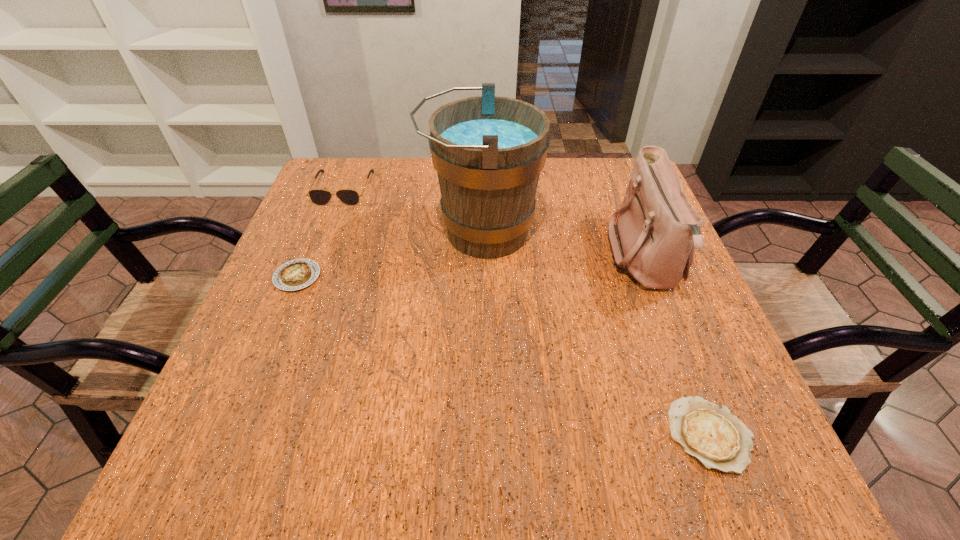
The height and width of the screenshot is (540, 960). I want to click on vacant area at the far right corner of the desktop, so click(x=627, y=171).

Find the location of a particular element. vacant area that lies between the sunglasses and the right quiche is located at coordinates coord(526,312).

You are a GUI agent. You are given a task and a screenshot of the screen. Output one action in this format:
    pyautogui.click(x=<x>, y=<y>)
    Task: Click on the free spot between the third tallest object and the left quiche
    
    Given the screenshot: What is the action you would take?
    pyautogui.click(x=321, y=232)

At what (x,y) coordinates should I click in order to perform the action: click on unoccupied position between the farther quiche and the sunglasses. Please return your answer as a coordinate pair (x, y). Image resolution: width=960 pixels, height=540 pixels. Looking at the image, I should click on (321, 232).

Where is `vacant space that's between the right quiche and the tallest object`? This screenshot has height=540, width=960. vacant space that's between the right quiche and the tallest object is located at coordinates (595, 333).

Locate an element on the screen. vacant region between the sunglasses and the left quiche is located at coordinates (321, 232).

The image size is (960, 540). I want to click on free point between the sunglasses and the tallest object, so click(412, 210).

Locate an element on the screen. This screenshot has width=960, height=540. free point between the second tallest object and the nearest object is located at coordinates (678, 347).

Where is `free space that is in between the shoulder bag and the farther quiche`? The image size is (960, 540). free space that is in between the shoulder bag and the farther quiche is located at coordinates (471, 268).

Image resolution: width=960 pixels, height=540 pixels. Find the location of `vacant area between the left quiche and the sunglasses`. vacant area between the left quiche and the sunglasses is located at coordinates (321, 232).